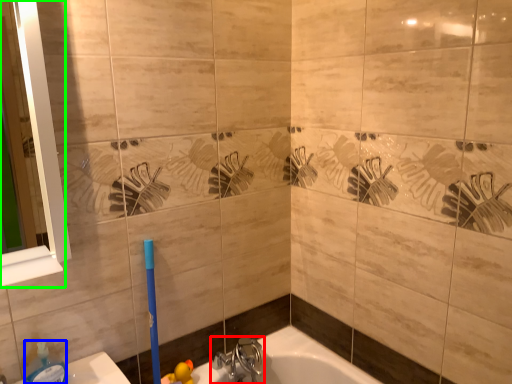
Question: Which object is the farthest from tap (highlighted by a red box)? Choose among these: soap dispenser (highlighted by a blue box) or mirror (highlighted by a green box).

Choices:
 (A) soap dispenser
 (B) mirror

Answer: (B)